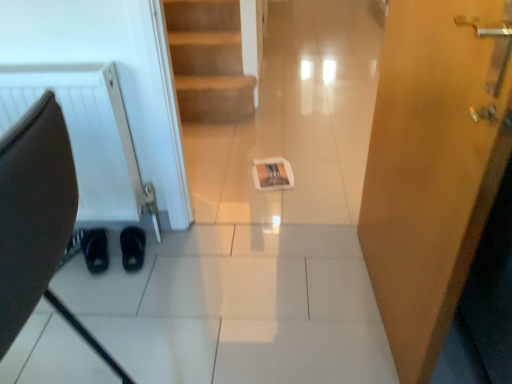
Image resolution: width=512 pixels, height=384 pixels. In order to click on free space between wooden door at right and black suede shoes at lower left, the first footwear from the left in this screenshot , I will do `click(257, 284)`.